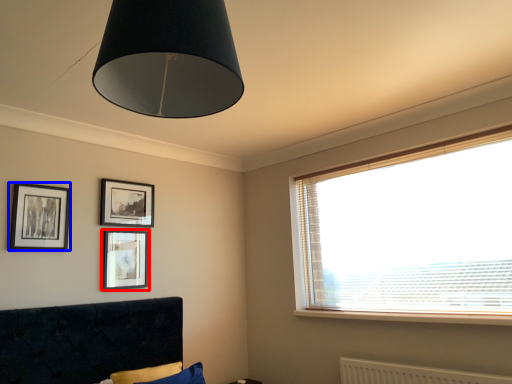
Question: Which of the following is the closest to the observer, picture frame (highlighted by a red box) or picture frame (highlighted by a blue box)?

Choices:
 (A) picture frame
 (B) picture frame

Answer: (B)